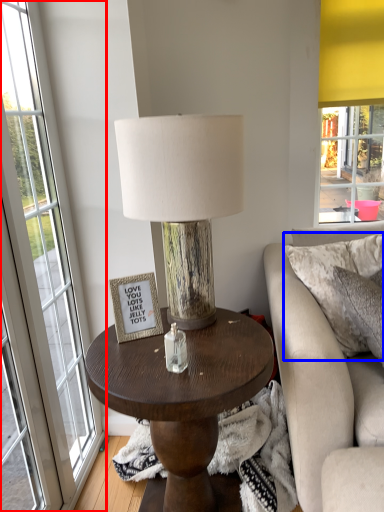
Question: Among these objects, which one is farthest to the camera, window (highlighted by a red box) or pillow (highlighted by a blue box)?

Choices:
 (A) window
 (B) pillow

Answer: (B)